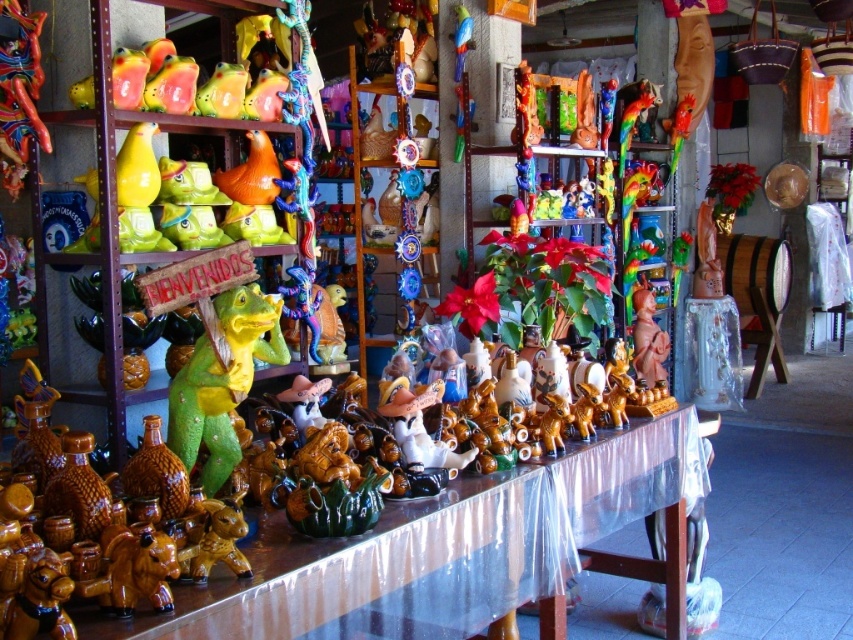
You are a customer in a shop and want to pick up the green matte dinosaur at center. The matte ceramic table at center is between you and the dinosaur. Can you reach the dinosaur without moving the table?

The matte ceramic table at center is in front of the green matte dinosaur at center, so you cannot reach the dinosaur without moving the table.

Consider the image. You are a delivery person who needs to place a package between the matte ceramic table at center and the green matte dinosaur at center. The package is 16 inches long. Can the package fit in the space between them?

The distance between the matte ceramic table at center and the green matte dinosaur at center is 18.75 inches. Since the package is 16 inches long, it can fit in the space between them as there is enough room.

You are a delivery person who needs to place a large package on the matte ceramic table at center. The package is 4 feet long. Can you fit the package on the table without it hanging over the edge? Please explain your reasoning based on the table dimensions provided.

The distance between the matte ceramic table at center and the camera is 4.25 feet, but this measurement refers to the distance from the camera to the table, not the table size. The table dimensions are not provided in the description, so it is impossible to determine if the package will fit without additional information about the table length.